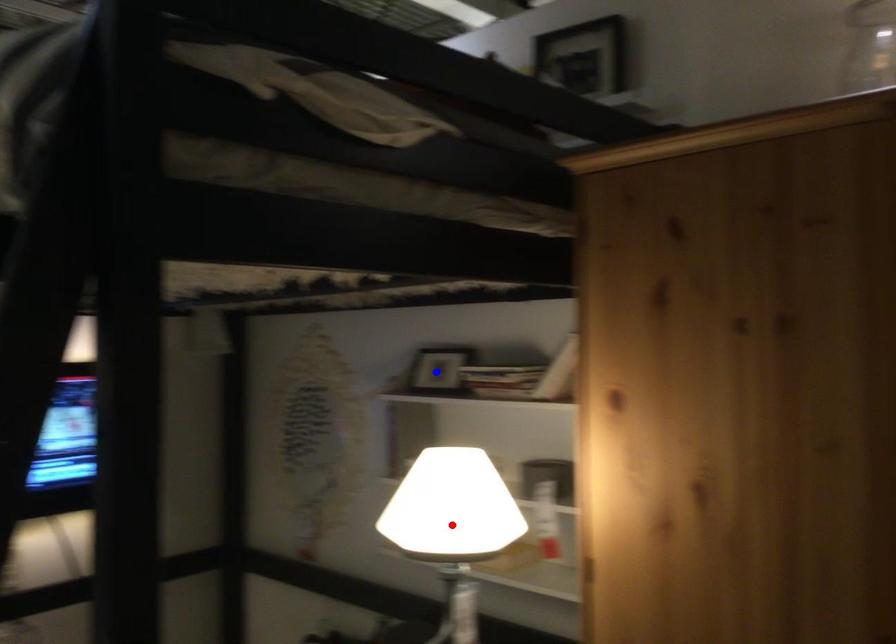
Question: In the image, two points are highlighted. Which point is nearer to the camera? Reply with the corresponding letter.

Choices:
 (A) blue point
 (B) red point

Answer: (B)